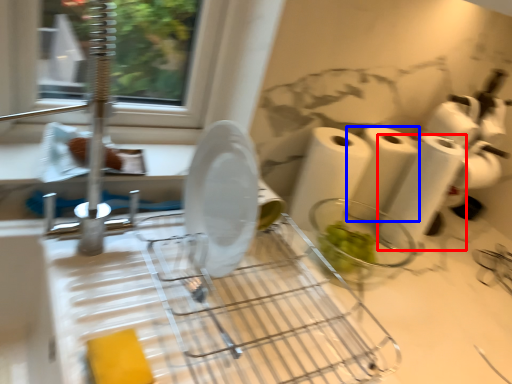
Question: Which point is closer to the camera, toilet paper (highlighted by a red box) or paper towel (highlighted by a blue box)?

Choices:
 (A) toilet paper
 (B) paper towel

Answer: (A)